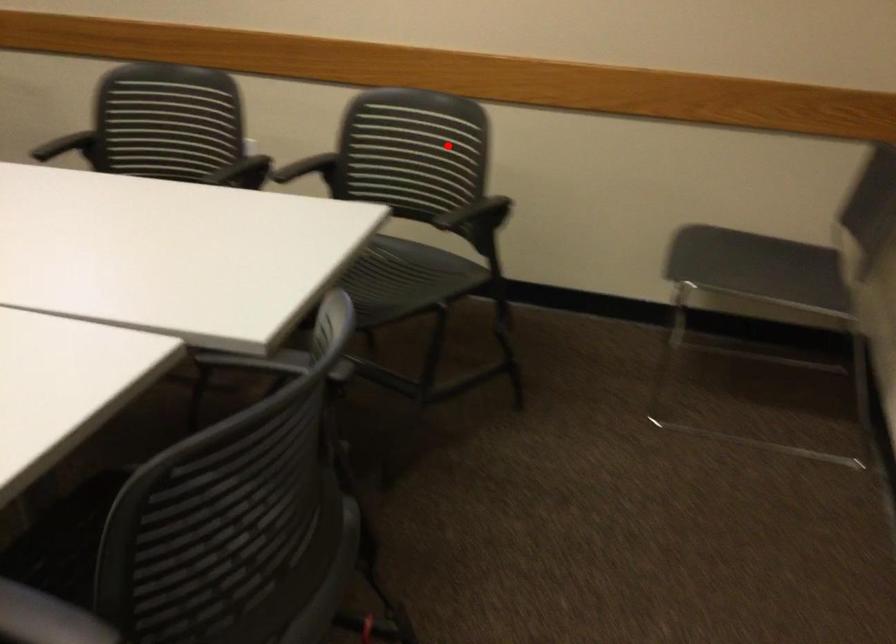
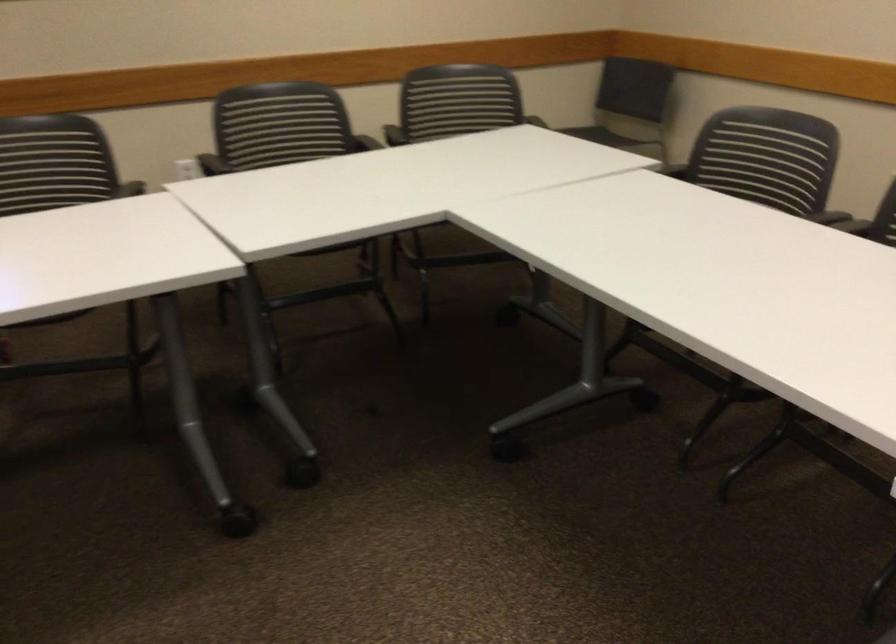
Find the pixel in the second image that matches the highlighted location in the first image.

(455, 100)